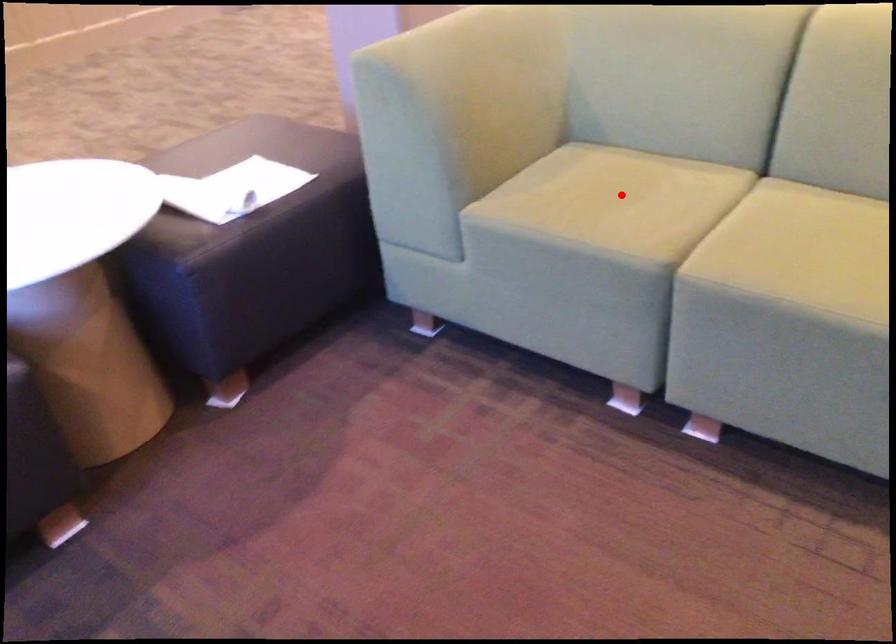
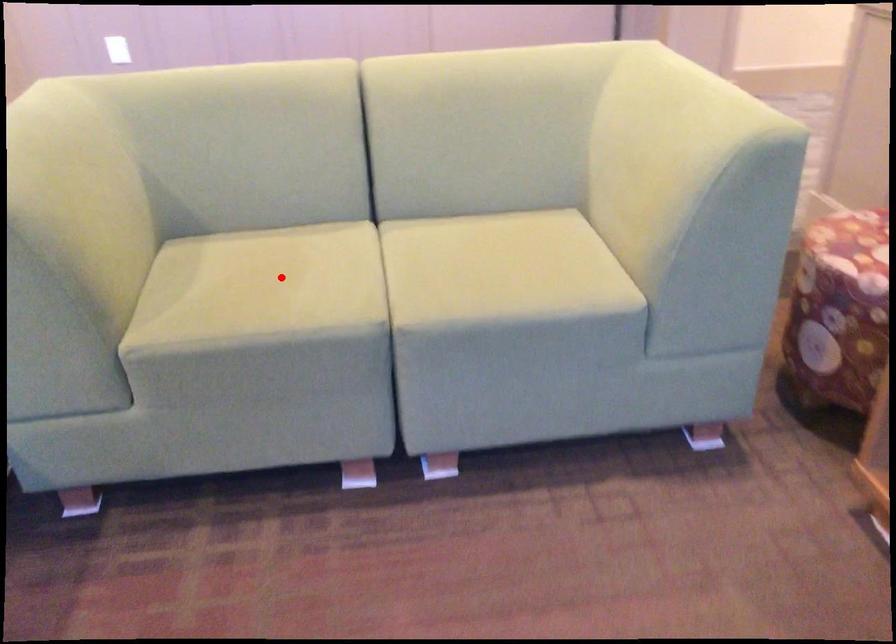
I am providing you with two images of the same scene from different viewpoints. A red point is marked on the first image and another point is marked on the second image. Does the point marked in image1 correspond to the same location as the one in image2?

Yes